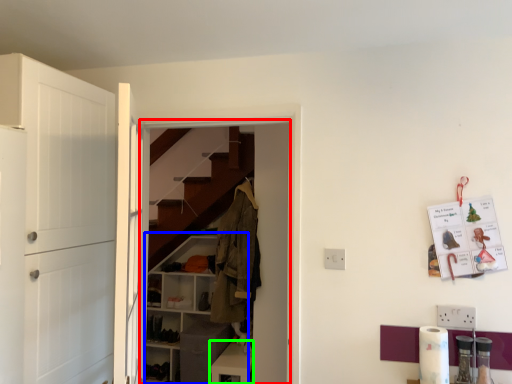
Question: Considering the real-world distances, which object is closest to closet (highlighted by a red box)? cabinetry (highlighted by a blue box) or cabinetry (highlighted by a green box).

Choices:
 (A) cabinetry
 (B) cabinetry

Answer: (B)